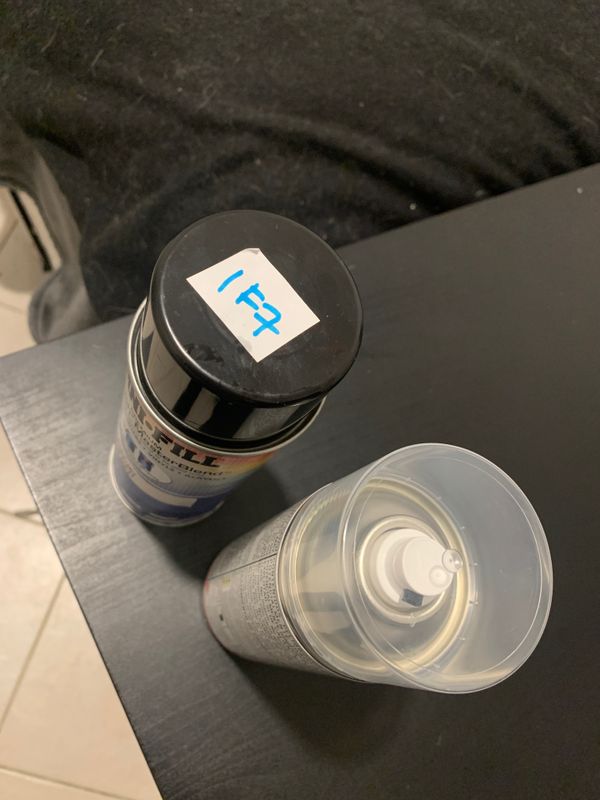
Where is `table`? The width and height of the screenshot is (600, 800). table is located at coordinates (138, 633).